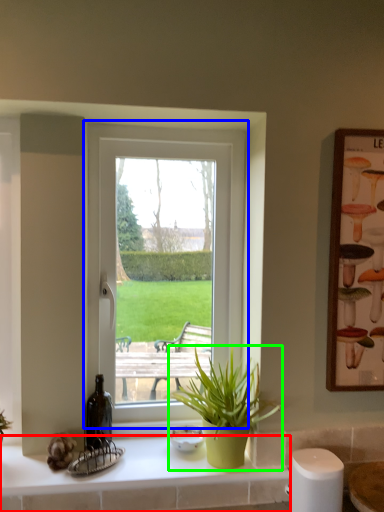
Question: Estimate the real-world distances between objects in this image. Which object is farther from counter top (highlighted by a red box), window (highlighted by a blue box) or houseplant (highlighted by a green box)?

Choices:
 (A) window
 (B) houseplant

Answer: (A)